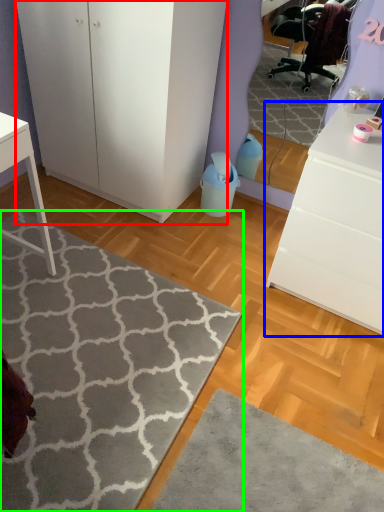
Question: Which is farther away from cabinetry (highlighted by a red box)? chest of drawers (highlighted by a blue box) or doormat (highlighted by a green box)?

Choices:
 (A) chest of drawers
 (B) doormat

Answer: (A)